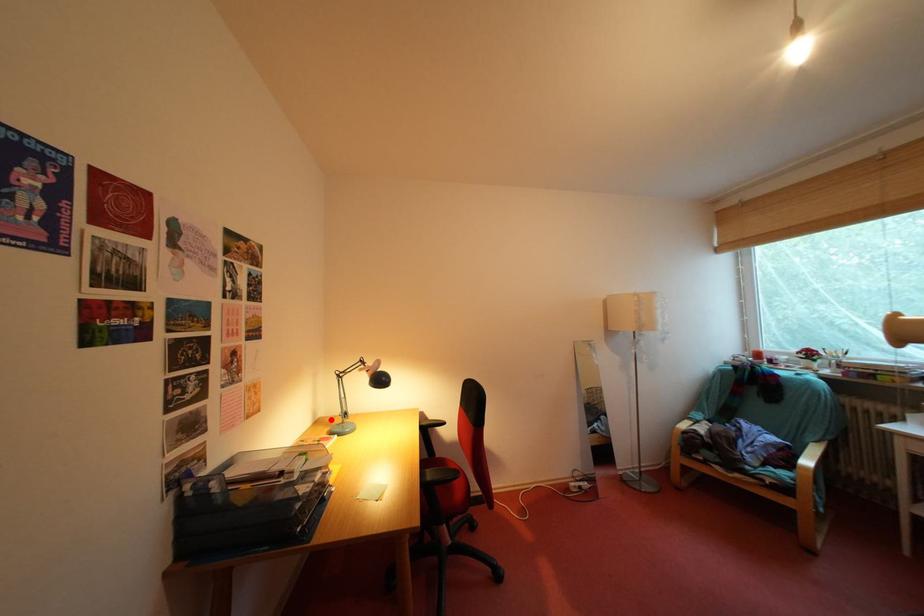
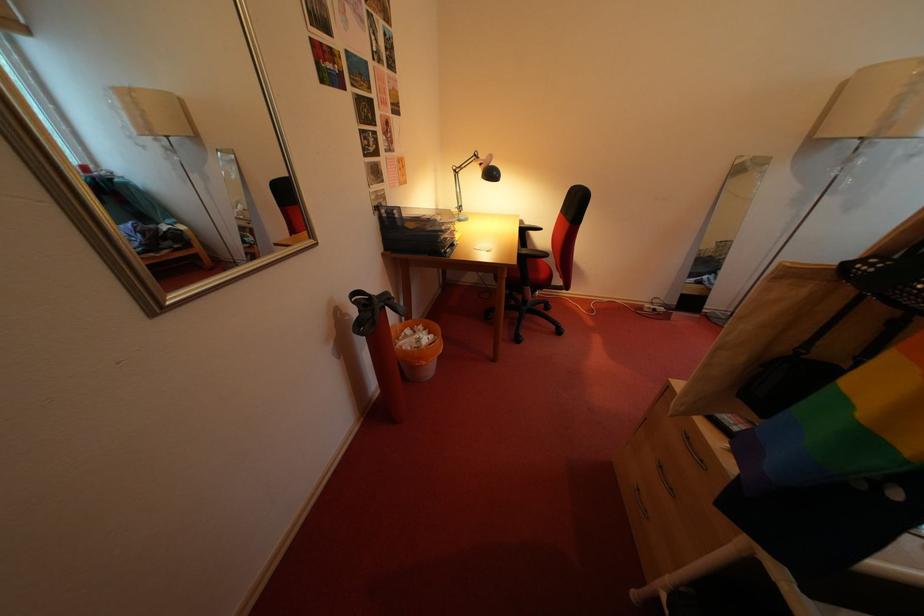
In the second image, find the point that corresponds to the highlighted location in the first image.

(451, 214)